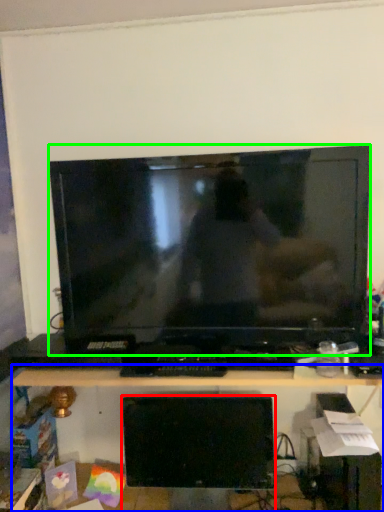
Question: Estimate the real-world distances between objects in this image. Which object is closer to computer monitor (highlighted by a red box), desk (highlighted by a blue box) or television (highlighted by a green box)?

Choices:
 (A) desk
 (B) television

Answer: (A)